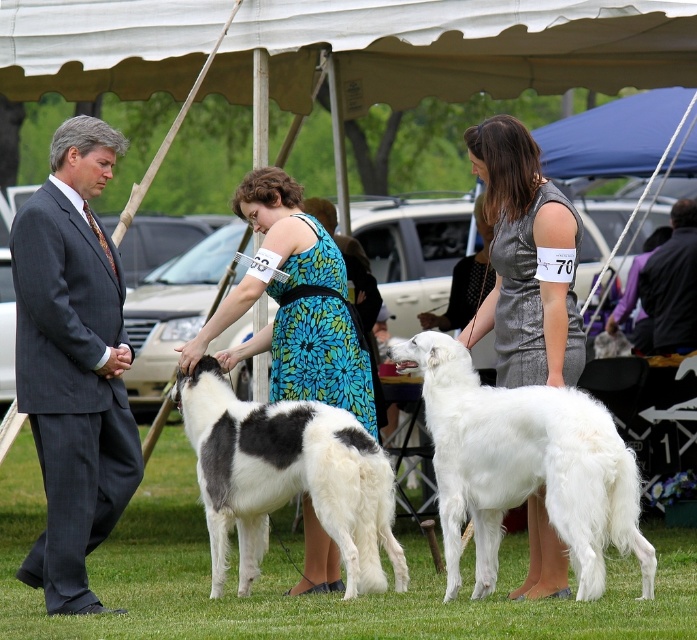
Is white fluffy dog at center to the left of blue fabric canopy at upper center from the viewer's perspective?

Indeed, white fluffy dog at center is positioned on the left side of blue fabric canopy at upper center.

Can you confirm if white fluffy dog at center is positioned to the right of blue fabric canopy at upper center?

No, white fluffy dog at center is not to the right of blue fabric canopy at upper center.

I want to click on white fluffy dog at center, so [523, 467].

In order to click on white fluffy dog at center in this screenshot , I will do `click(523, 467)`.

Is white canvas canopy at upper center positioned at the back of black and white fur at center?

That is True.

Is white canvas canopy at upper center below black and white fur at center?

Actually, white canvas canopy at upper center is above black and white fur at center.

Who is more forward, (572, 20) or (201, 488)?

Point (201, 488) is in front.

This screenshot has width=697, height=640. Identify the location of white canvas canopy at upper center. (454, 49).

Can you confirm if black and white fur at center is smaller than black leather jacket at lower right?

Indeed, black and white fur at center has a smaller size compared to black leather jacket at lower right.

Is black and white fur at center shorter than black leather jacket at lower right?

Yes, black and white fur at center is shorter than black leather jacket at lower right.

What are the coordinates of `black and white fur at center` in the screenshot? It's located at (286, 477).